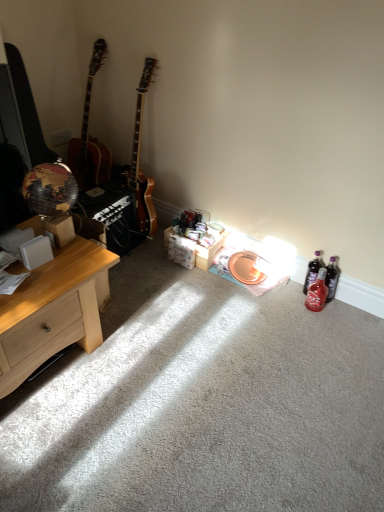
Question: Is light wood desk at left surrounding white cardboard box at center?

Choices:
 (A) no
 (B) yes

Answer: (A)

Question: From a real-world perspective, is light wood desk at left located beneath white cardboard box at center?

Choices:
 (A) no
 (B) yes

Answer: (A)

Question: Does light wood desk at left have a smaller size compared to white cardboard box at center?

Choices:
 (A) no
 (B) yes

Answer: (A)

Question: From the image's perspective, is light wood desk at left above white cardboard box at center?

Choices:
 (A) yes
 (B) no

Answer: (B)

Question: Does light wood desk at left have a greater width compared to white cardboard box at center?

Choices:
 (A) yes
 (B) no

Answer: (A)

Question: Considering the relative sizes of light wood desk at left and white cardboard box at center in the image provided, is light wood desk at left taller than white cardboard box at center?

Choices:
 (A) no
 (B) yes

Answer: (B)

Question: From a real-world perspective, is white cardboard box at center below light wood desk at left?

Choices:
 (A) no
 (B) yes

Answer: (B)

Question: Is white cardboard box at center bigger than light wood desk at left?

Choices:
 (A) no
 (B) yes

Answer: (A)

Question: Would you say light wood desk at left is part of white cardboard box at center's contents?

Choices:
 (A) yes
 (B) no

Answer: (B)

Question: Would you say white cardboard box at center is outside light wood desk at left?

Choices:
 (A) no
 (B) yes

Answer: (B)

Question: Considering the relative positions of white cardboard box at center and light wood desk at left in the image provided, is white cardboard box at center behind light wood desk at left?

Choices:
 (A) yes
 (B) no

Answer: (A)

Question: Does white cardboard box at center touch light wood desk at left?

Choices:
 (A) no
 (B) yes

Answer: (A)

Question: Considering the relative sizes of translucent red glass bottle at lower right, acting as the 2th bottle starting from the back, and translucent purple bottle at lower right, which appears as the first bottle when viewed from the back, in the image provided, is translucent red glass bottle at lower right, acting as the 2th bottle starting from the back, smaller than translucent purple bottle at lower right, which appears as the first bottle when viewed from the back,?

Choices:
 (A) yes
 (B) no

Answer: (B)